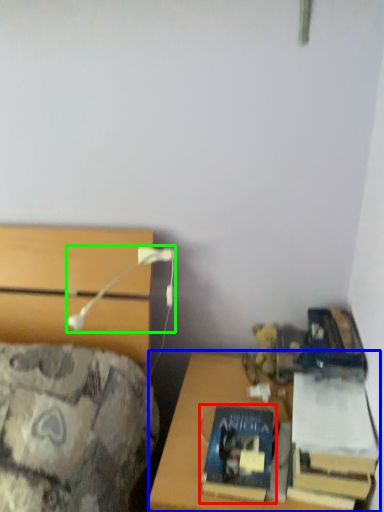
Question: Estimate the real-world distances between objects in this image. Which object is closer to book (highlighted by a red box), desk (highlighted by a blue box) or table lamp (highlighted by a green box)?

Choices:
 (A) desk
 (B) table lamp

Answer: (A)